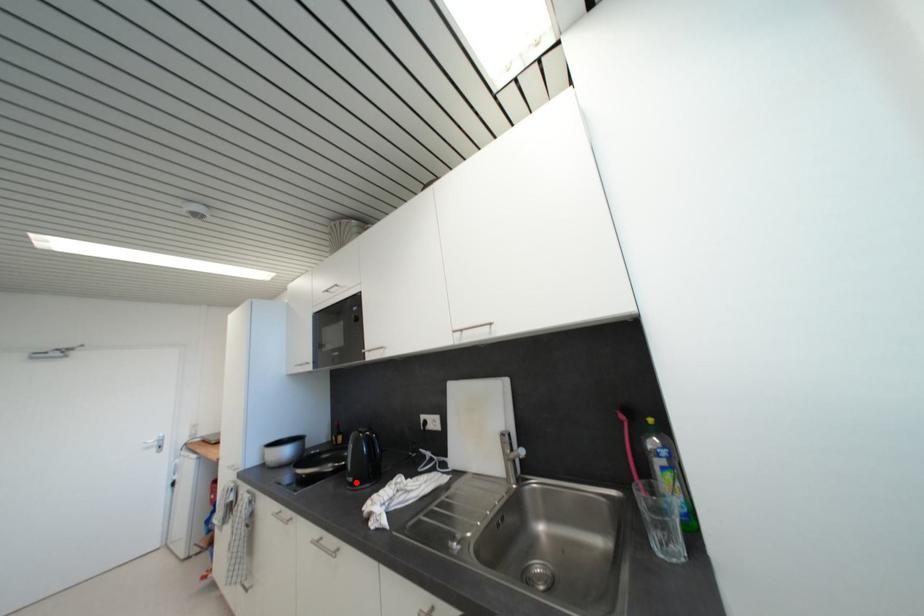
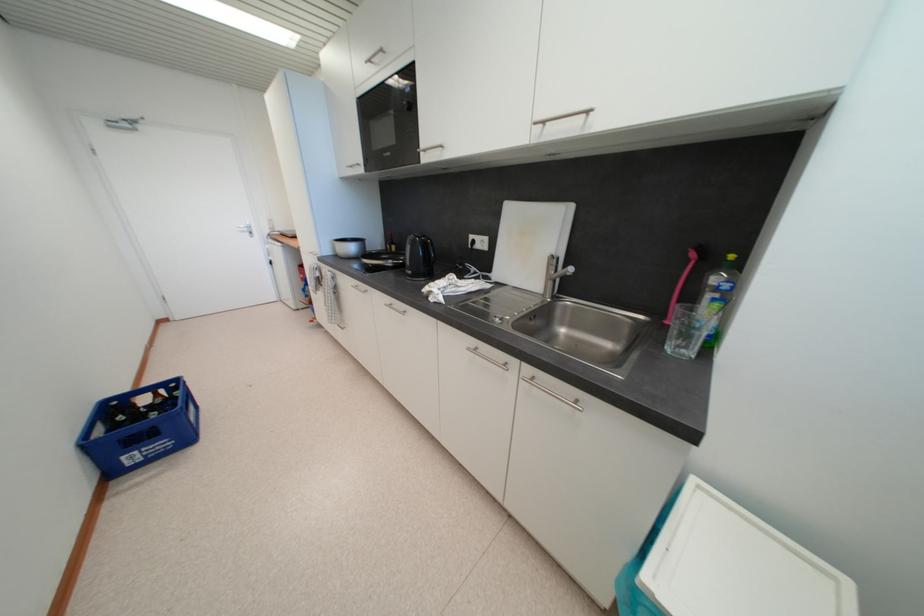
Locate, in the second image, the point that corresponds to the highlighted location in the first image.

(415, 275)